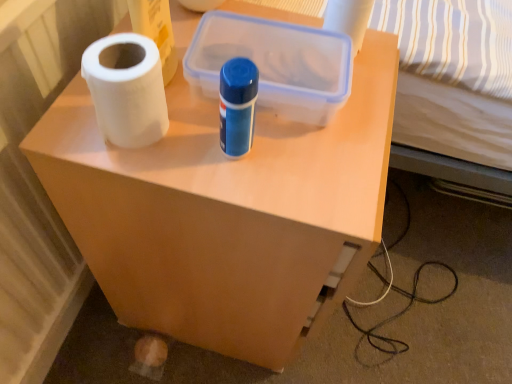
Question: Is point (234, 34) closer or farther from the camera than point (330, 9)?

Choices:
 (A) closer
 (B) farther

Answer: (B)

Question: Is transparent plastic storage box at center to the left or to the right of white matte toilet paper at upper center in the image?

Choices:
 (A) left
 (B) right

Answer: (A)

Question: Which is farther from the white matte toilet paper at upper center?

Choices:
 (A) white matte paper towel at left
 (B) transparent plastic storage box at center
 (C) matte plastic side table at center

Answer: (C)

Question: Estimate the real-world distances between objects in this image. Which object is closer to the matte plastic side table at center?

Choices:
 (A) white matte toilet paper at upper center
 (B) white matte paper towel at left
 (C) transparent plastic storage box at center

Answer: (C)